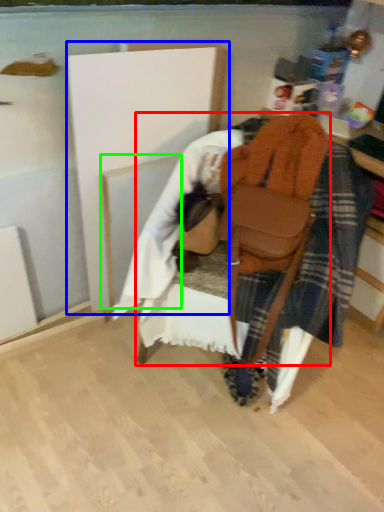
Question: Which is nearer to the furniture (highlighted by a red box)? wood (highlighted by a blue box) or wood (highlighted by a green box).

Choices:
 (A) wood
 (B) wood

Answer: (A)